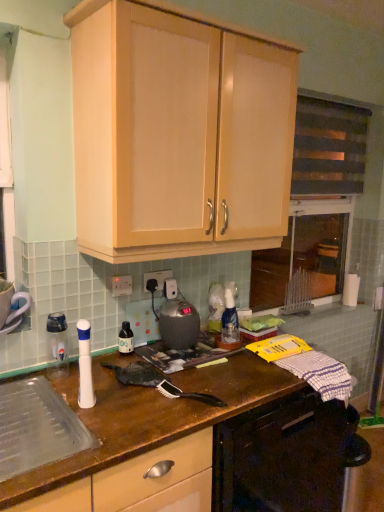
Describe the element at coordinates (126, 339) in the screenshot. Image resolution: width=384 pixels, height=512 pixels. I see `matte black bottle at center` at that location.

What is the approximate width of dark fabric window screen at upper right?

The width of dark fabric window screen at upper right is 4.34 inches.

I want to click on dark fabric window screen at upper right, so click(329, 147).

Describe the element at coordinates (150, 416) in the screenshot. I see `wooden at center` at that location.

This screenshot has width=384, height=512. Describe the element at coordinates (121, 285) in the screenshot. I see `white plastic electric outlet at center, acting as the second electric outlet starting from the right` at that location.

Locate an element on the screen. The height and width of the screenshot is (512, 384). white plastic electric outlet at center, positioned as the 1th electric outlet in left-to-right order is located at coordinates (121, 285).

The width and height of the screenshot is (384, 512). I want to click on metallic gray kettle at center, so click(179, 324).

Is dark fabric window screen at upper right touching matte black bottle at center?

dark fabric window screen at upper right is not next to matte black bottle at center, and they're not touching.

Locate an element on the screen. The height and width of the screenshot is (512, 384). bottle that is below the dark fabric window screen at upper right (from the image's perspective) is located at coordinates 126,339.

From a real-world perspective, is dark fabric window screen at upper right over matte black bottle at center?

Yes, from a real-world perspective, dark fabric window screen at upper right is on top of matte black bottle at center.

Is the surface of metallic gray kettle at center in direct contact with matte wood cabinet at upper center?

There is a gap between metallic gray kettle at center and matte wood cabinet at upper center.

Does metallic gray kettle at center turn towards matte wood cabinet at upper center?

No, metallic gray kettle at center does not turn towards matte wood cabinet at upper center.

From a real-world perspective, is metallic gray kettle at center positioned above or below matte wood cabinet at upper center?

Clearly, from a real-world perspective, metallic gray kettle at center is below matte wood cabinet at upper center.

From the image's perspective, would you say metallic gray kettle at center is shown under matte wood cabinet at upper center?

Yes.

How many degrees apart are the facing directions of matte wood cabinet at upper center and matte black bottle at center?

0.00244 degrees.

Consider the image. From the image's perspective, is matte wood cabinet at upper center located above or below matte black bottle at center?

matte wood cabinet at upper center is situated higher than matte black bottle at center in the image.

Which is behind, point (207, 253) or point (126, 326)?

The point (126, 326) is farther from the camera.

Considering the sizes of matte wood cabinet at upper center and matte black bottle at center in the image, is matte wood cabinet at upper center taller or shorter than matte black bottle at center?

In the image, matte wood cabinet at upper center appears to be taller than matte black bottle at center.

Between white plastic electric outlet at center, which ranks as the first electric outlet in front-to-back order, and clear plastic bottle at left, which one appears on the left side from the viewer's perspective?

Positioned to the left is clear plastic bottle at left.

Considering the sizes of white plastic electric outlet at center, acting as the second electric outlet starting from the right, and clear plastic bottle at left in the image, is white plastic electric outlet at center, acting as the second electric outlet starting from the right, taller or shorter than clear plastic bottle at left?

In the image, white plastic electric outlet at center, acting as the second electric outlet starting from the right, appears to be shorter than clear plastic bottle at left.

Is white plastic electric outlet at center, positioned as the 1th electric outlet in left-to-right order, completely or partially outside of clear plastic bottle at left?

That's correct, white plastic electric outlet at center, positioned as the 1th electric outlet in left-to-right order, is outside of clear plastic bottle at left.

From the image's perspective, is white plastic electric outlet at center, which ranks as the first electric outlet in front-to-back order, beneath clear plastic bottle at left?

No, from the image's perspective, white plastic electric outlet at center, which ranks as the first electric outlet in front-to-back order, is not below clear plastic bottle at left.

Is matte black bottle at center completely or partially inside white plastic electric outlet at center, which is the first electric outlet in right-to-left order?

No, white plastic electric outlet at center, which is the first electric outlet in right-to-left order, does not contain matte black bottle at center.

Which of these two, white plastic electric outlet at center, the 1th electric outlet from the back, or matte black bottle at center, is thinner?

Thinner between the two is white plastic electric outlet at center, the 1th electric outlet from the back.

Who is more distant, white plastic electric outlet at center, acting as the second electric outlet starting from the front, or matte black bottle at center?

white plastic electric outlet at center, acting as the second electric outlet starting from the front, is further away from the camera.

From the picture: In terms of size, does white plastic electric outlet at center, the 1th electric outlet from the back, appear bigger or smaller than matte black bottle at center?

white plastic electric outlet at center, the 1th electric outlet from the back, is smaller than matte black bottle at center.

Considering the sizes of matte black bottle at center and wooden at center in the image, is matte black bottle at center bigger or smaller than wooden at center?

Considering their sizes, matte black bottle at center takes up less space than wooden at center.

Considering the positions of objects matte black bottle at center and wooden at center in the image provided, who is in front, matte black bottle at center or wooden at center?

wooden at center is in front.

From the image's perspective, is matte black bottle at center under wooden at center?

No.

Is wooden at center located within matte black bottle at center?

No, wooden at center is not a part of matte black bottle at center.

Is matte wood cabinet at upper center located outside white plastic electric outlet at center, the second electric outlet from the back?

Yes, matte wood cabinet at upper center is not within white plastic electric outlet at center, the second electric outlet from the back.

Based on the photo, is matte wood cabinet at upper center oriented towards white plastic electric outlet at center, which ranks as the first electric outlet in front-to-back order?

No, matte wood cabinet at upper center is not turned towards white plastic electric outlet at center, which ranks as the first electric outlet in front-to-back order.

Is matte wood cabinet at upper center in contact with white plastic electric outlet at center, acting as the second electric outlet starting from the right?

No, matte wood cabinet at upper center is not beside white plastic electric outlet at center, acting as the second electric outlet starting from the right.

Is matte wood cabinet at upper center shorter than white plastic electric outlet at center, positioned as the 1th electric outlet in left-to-right order?

Incorrect, the height of matte wood cabinet at upper center does not fall short of that of white plastic electric outlet at center, positioned as the 1th electric outlet in left-to-right order.

Find the location of a particular element. Image resolution: width=384 pixels, height=512 pixels. window screen above the matte black bottle at center (from the image's perspective) is located at coordinates (329, 147).

Where is `cabinetry above the metallic gray kettle at center (from a real-world perspective)`? The width and height of the screenshot is (384, 512). cabinetry above the metallic gray kettle at center (from a real-world perspective) is located at coordinates (177, 134).

Estimate the real-world distances between objects in this image. Which object is further from dark fabric window screen at upper right, matte black bottle at center or wooden at center?

matte black bottle at center lies further to dark fabric window screen at upper right than the other object.

From the image, which object appears to be farther from matte wood cabinet at upper center, white plastic electric outlet at center, which is the first electric outlet in right-to-left order, or matte black bottle at center?

matte black bottle at center lies further to matte wood cabinet at upper center than the other object.

Estimate the real-world distances between objects in this image. Which object is further from matte wood cabinet at upper center, white plastic electric outlet at center, the second electric outlet from the back, or wooden at center?

wooden at center.

Considering their positions, is dark fabric window screen at upper right positioned closer to wooden at center than matte wood cabinet at upper center?

Based on the image, matte wood cabinet at upper center appears to be nearer to wooden at center.

Considering their positions, is metallic gray kettle at center positioned further to wooden at center than matte black bottle at center?

matte black bottle at center.

When comparing their distances from white plastic electric outlet at center, acting as the second electric outlet starting from the right, does clear plastic bottle at left or wooden at center seem further?

wooden at center.

Estimate the real-world distances between objects in this image. Which object is further from wooden at center, metallic gray kettle at center or white plastic electric outlet at center, acting as the second electric outlet starting from the front?

white plastic electric outlet at center, acting as the second electric outlet starting from the front, is positioned further to the anchor wooden at center.

Which object lies nearer to the anchor point matte wood cabinet at upper center, matte black bottle at center or wooden at center?

Based on the image, wooden at center appears to be nearer to matte wood cabinet at upper center.

Image resolution: width=384 pixels, height=512 pixels. I want to click on electric outlet situated between matte black bottle at center and dark fabric window screen at upper right from left to right, so click(x=157, y=278).

Identify the location of bottle located between clear plastic bottle at left and wooden at center in the left-right direction. The height and width of the screenshot is (512, 384). (126, 339).

Where is `electric outlet between white plastic electric outlet at center, which is the first electric outlet in right-to-left order, and wooden at center in the up-down direction`? electric outlet between white plastic electric outlet at center, which is the first electric outlet in right-to-left order, and wooden at center in the up-down direction is located at coordinates (121, 285).

Where is `appliance between white plastic electric outlet at center, the second electric outlet from the back, and wooden at center in the up-down direction`? This screenshot has width=384, height=512. appliance between white plastic electric outlet at center, the second electric outlet from the back, and wooden at center in the up-down direction is located at coordinates (57, 345).